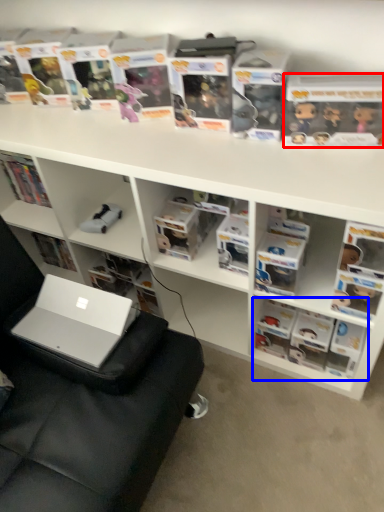
Question: Which point is further to the camera, paperback book (highlighted by a red box) or book (highlighted by a blue box)?

Choices:
 (A) paperback book
 (B) book

Answer: (B)